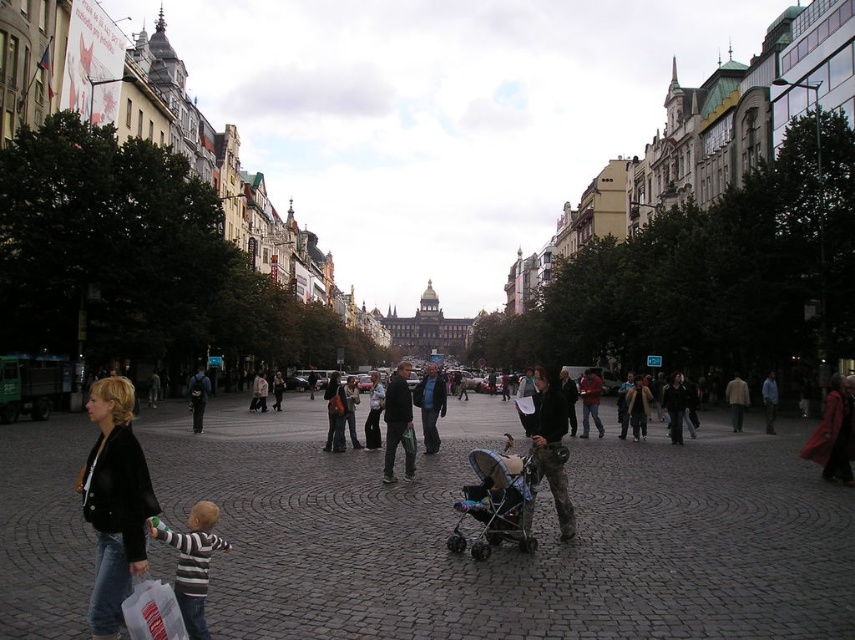
Question: Is black leather jacket at lower left in front of striped cotton shirt at lower left?

Choices:
 (A) no
 (B) yes

Answer: (B)

Question: Among these objects, which one is farthest from the camera?

Choices:
 (A) striped cotton shirt at lower left
 (B) matte black stroller at center
 (C) black leather jacket at lower left

Answer: (B)

Question: Can you confirm if black leather jacket at lower left is positioned to the right of striped cotton shirt at lower left?

Choices:
 (A) yes
 (B) no

Answer: (B)

Question: Is matte black stroller at center in front of striped cotton shirt at lower left?

Choices:
 (A) no
 (B) yes

Answer: (A)

Question: Which point is closer to the camera?

Choices:
 (A) black leather jacket at lower left
 (B) striped cotton shirt at lower left

Answer: (A)

Question: Which object is positioned closest to the black leather jacket at lower left?

Choices:
 (A) striped cotton shirt at lower left
 (B) matte black stroller at center

Answer: (A)